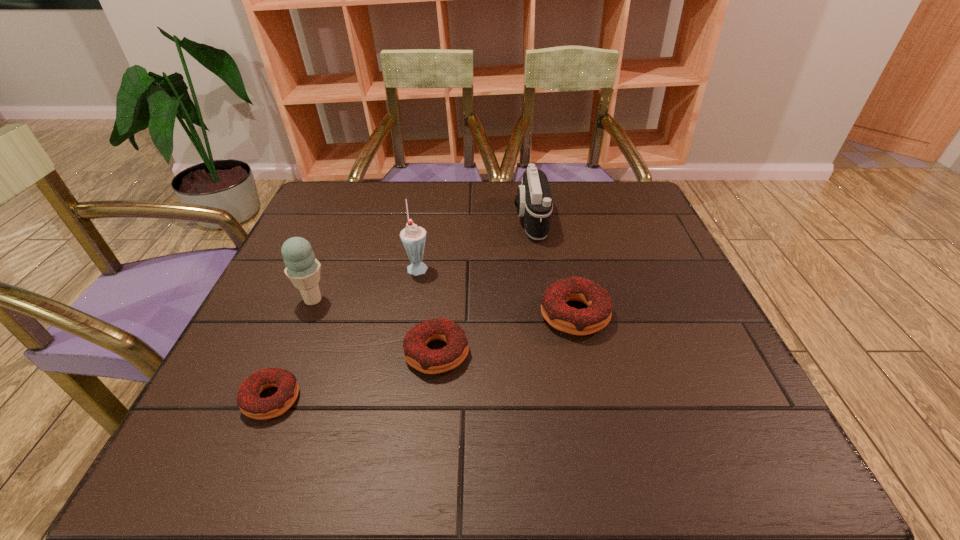
Please point a vacant point for placing a doughnut on the right. Please provide its 2D coordinates. Your answer should be formatted as a tuple, i.e. [(x, y)], where the tuple contains the x and y coordinates of a point satisfying the conditions above.

[(692, 282)]